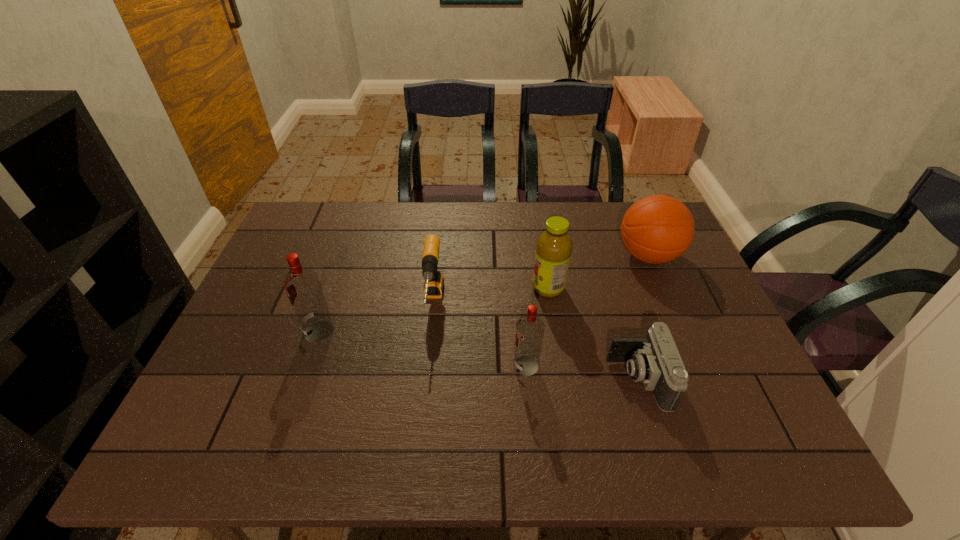
In order to click on free region located 0.380m at the front of the camera with an open lens cover in this screenshot , I will do `click(445, 380)`.

Where is `vacant space located 0.170m at the front of the camera with an open lens cover`? The image size is (960, 540). vacant space located 0.170m at the front of the camera with an open lens cover is located at coordinates (536, 380).

Where is `vacant point located 0.350m at the front of the camera with an open lens cover`? vacant point located 0.350m at the front of the camera with an open lens cover is located at coordinates (458, 380).

I want to click on object at the far edge, so click(656, 229).

Locate an element on the screen. object present at the near edge is located at coordinates (655, 361).

This screenshot has width=960, height=540. Find the location of `object that is at the right edge`. object that is at the right edge is located at coordinates (656, 229).

Find the location of a particular element. object present at the far right corner is located at coordinates (656, 229).

Find the location of `free space at the far edge of the desktop`. free space at the far edge of the desktop is located at coordinates (385, 238).

In the image, there is a desktop. At what (x,y) coordinates should I click in order to perform the action: click on blank space at the near edge. Please return your answer as a coordinate pair (x, y). Looking at the image, I should click on (616, 381).

The height and width of the screenshot is (540, 960). I want to click on free space at the left edge of the desktop, so click(258, 362).